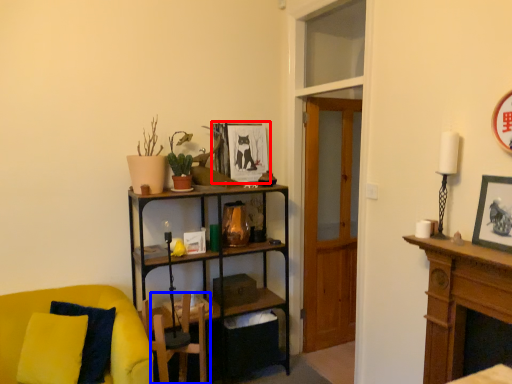
Question: Which point is closer to the camera, picture frame (highlighted by a red box) or swivel chair (highlighted by a blue box)?

Choices:
 (A) picture frame
 (B) swivel chair

Answer: (B)